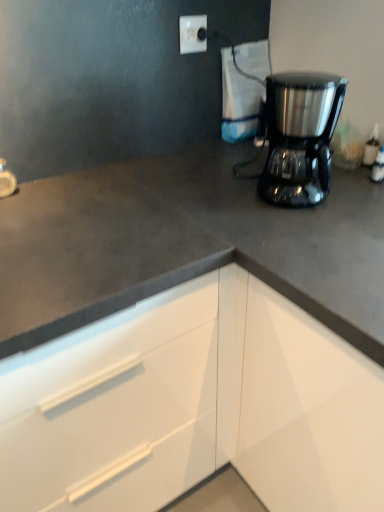
Question: Does white glossy cabinet at lower right come behind satin black coffee maker at upper right?

Choices:
 (A) yes
 (B) no

Answer: (B)

Question: Is white glossy cabinet at lower right wider than satin black coffee maker at upper right?

Choices:
 (A) no
 (B) yes

Answer: (B)

Question: From the image's perspective, is white glossy cabinet at lower right beneath satin black coffee maker at upper right?

Choices:
 (A) no
 (B) yes

Answer: (B)

Question: Does white glossy cabinet at lower right have a larger size compared to satin black coffee maker at upper right?

Choices:
 (A) no
 (B) yes

Answer: (B)

Question: Are white glossy cabinet at lower right and satin black coffee maker at upper right located far from each other?

Choices:
 (A) no
 (B) yes

Answer: (A)

Question: In the image, is satin black coffee maker at upper right positioned in front of or behind white glossy faucet at upper left?

Choices:
 (A) behind
 (B) front

Answer: (B)

Question: From the image's perspective, is satin black coffee maker at upper right above or below white glossy faucet at upper left?

Choices:
 (A) above
 (B) below

Answer: (A)

Question: Is point (314, 92) closer or farther from the camera than point (13, 179)?

Choices:
 (A) closer
 (B) farther

Answer: (A)

Question: Is satin black coffee maker at upper right to the left or to the right of white glossy faucet at upper left in the image?

Choices:
 (A) left
 (B) right

Answer: (B)

Question: In terms of width, does white glossy faucet at upper left look wider or thinner when compared to white glossy cabinet at lower right?

Choices:
 (A) thin
 (B) wide

Answer: (A)

Question: From the image's perspective, is white glossy faucet at upper left located above or below white glossy cabinet at lower right?

Choices:
 (A) below
 (B) above

Answer: (B)

Question: Is point (0, 169) positioned closer to the camera than point (193, 298)?

Choices:
 (A) closer
 (B) farther

Answer: (B)

Question: From a real-world perspective, is white glossy faucet at upper left positioned above or below white glossy cabinet at lower right?

Choices:
 (A) below
 (B) above

Answer: (B)

Question: From a real-world perspective, is white glossy cabinet at lower right physically located above or below white plastic electric outlet at upper center?

Choices:
 (A) below
 (B) above

Answer: (A)

Question: From the image's perspective, relative to white plastic electric outlet at upper center, is white glossy cabinet at lower right above or below?

Choices:
 (A) above
 (B) below

Answer: (B)